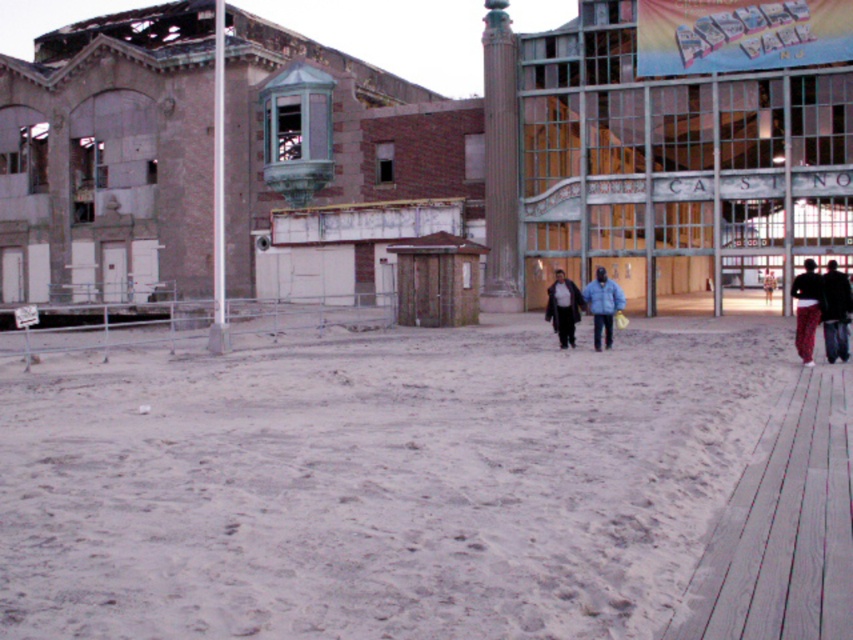
This screenshot has width=853, height=640. I want to click on dark blue jeans at lower right, so click(834, 312).

Where is `dark blue jeans at lower right`? dark blue jeans at lower right is located at coordinates (834, 312).

Which is above, white sandy beach at center or red plaid pants at lower right?

red plaid pants at lower right is higher up.

Does white sandy beach at center have a lesser width compared to red plaid pants at lower right?

Incorrect, white sandy beach at center's width is not less than red plaid pants at lower right's.

Is point (329, 516) in front of point (813, 284)?

That is True.

Find the location of `white sandy beach at center`. white sandy beach at center is located at coordinates (376, 483).

Can you confirm if white sandy beach at center is positioned below dark blue jeans at lower right?

Correct, white sandy beach at center is located below dark blue jeans at lower right.

Describe the element at coordinates (376, 483) in the screenshot. The height and width of the screenshot is (640, 853). I see `white sandy beach at center` at that location.

Locate an element on the screen. white sandy beach at center is located at coordinates (376, 483).